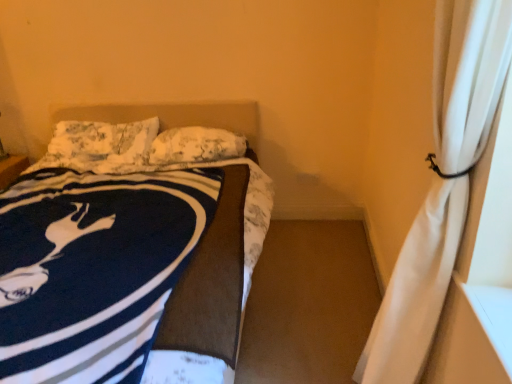
Measure the distance between point (111, 159) and camera.

Point (111, 159) is 8.45 feet from camera.

What do you see at coordinates (196, 145) in the screenshot?
I see `white textured pillow at center, which appears as the 2th pillow when viewed from the left` at bounding box center [196, 145].

This screenshot has height=384, width=512. I want to click on white textured pillow at center, which appears as the 2th pillow when viewed from the left, so click(x=196, y=145).

You are a GUI agent. You are given a task and a screenshot of the screen. Output one action in this format:
    pyautogui.click(x=<x>, y=<y>)
    Task: Click on the fluffy white pillow at upper left, which is the second pillow from right to left
    The image size is (512, 384).
    Given the screenshot: What is the action you would take?
    pyautogui.click(x=99, y=145)

Can you confirm if fluffy white pillow at upper left, which is the 1th pillow in left-to-right order, is shorter than white sheer curtain at right?

Yes.

Is point (95, 125) positioned behind point (465, 127)?

That is True.

From a real-world perspective, does fluffy white pillow at upper left, which is the 1th pillow in left-to-right order, stand above white sheer curtain at right?

No, from a real-world perspective, fluffy white pillow at upper left, which is the 1th pillow in left-to-right order, is not above white sheer curtain at right.

Looking at this image, how much distance is there between fluffy white pillow at upper left, which is the 1th pillow in left-to-right order, and white sheer curtain at right?

They are 6.43 feet apart.

Which is less distant, (x=120, y=130) or (x=59, y=316)?

Clearly, point (x=120, y=130) is more distant from the camera than point (x=59, y=316).

Is fluffy white pillow at upper left, which is the second pillow from right to left, further to the viewer compared to navy blue fleece blanket at left?

That is True.

Visually, is fluffy white pillow at upper left, which is the 1th pillow in left-to-right order, positioned to the left or to the right of navy blue fleece blanket at left?

In the image, fluffy white pillow at upper left, which is the 1th pillow in left-to-right order, appears on the left side of navy blue fleece blanket at left.

Considering the sizes of objects fluffy white pillow at upper left, which is the second pillow from right to left, and navy blue fleece blanket at left in the image provided, who is thinner, fluffy white pillow at upper left, which is the second pillow from right to left, or navy blue fleece blanket at left?

fluffy white pillow at upper left, which is the second pillow from right to left.

Does point (149, 141) come closer to viewer compared to point (215, 129)?

Yes.

Between fluffy white pillow at upper left, which is the second pillow from right to left, and white textured pillow at center, which appears as the 2th pillow when viewed from the left, which one has larger size?

With larger size is fluffy white pillow at upper left, which is the second pillow from right to left.

This screenshot has width=512, height=384. Identify the location of pillow that is above the white textured pillow at center, which appears as the 2th pillow when viewed from the left (from a real-world perspective). [99, 145].

Considering the sizes of fluffy white pillow at upper left, which is the 1th pillow in left-to-right order, and white textured pillow at center, which appears as the 2th pillow when viewed from the left, in the image, is fluffy white pillow at upper left, which is the 1th pillow in left-to-right order, wider or thinner than white textured pillow at center, which appears as the 2th pillow when viewed from the left,?

fluffy white pillow at upper left, which is the 1th pillow in left-to-right order, is wider than white textured pillow at center, which appears as the 2th pillow when viewed from the left.

Consider the image. From the image's perspective, between white sheer curtain at right and white textured pillow at center, placed as the 1th pillow when sorted from right to left, which one is located above?

white textured pillow at center, placed as the 1th pillow when sorted from right to left.

Is white sheer curtain at right wider or thinner than white textured pillow at center, which appears as the 2th pillow when viewed from the left?

white sheer curtain at right is thinner than white textured pillow at center, which appears as the 2th pillow when viewed from the left.

You are a GUI agent. You are given a task and a screenshot of the screen. Output one action in this format:
    pyautogui.click(x=<x>, y=<y>)
    Task: Click on the curtain above the white textured pillow at center, which appears as the 2th pillow when viewed from the left (from a real-world perspective)
    The image size is (512, 384).
    Given the screenshot: What is the action you would take?
    pyautogui.click(x=442, y=185)

Choose the correct answer: Is white sheer curtain at right inside white textured pillow at center, which appears as the 2th pillow when viewed from the left, or outside it?

white sheer curtain at right is spatially situated outside white textured pillow at center, which appears as the 2th pillow when viewed from the left.

Locate an element on the screen. The width and height of the screenshot is (512, 384). curtain that appears in front of the white textured pillow at center, placed as the 1th pillow when sorted from right to left is located at coordinates (442, 185).

Does white textured pillow at center, which appears as the 2th pillow when viewed from the left, appear on the right side of white sheer curtain at right?

No, white textured pillow at center, which appears as the 2th pillow when viewed from the left, is not to the right of white sheer curtain at right.

Are white textured pillow at center, placed as the 1th pillow when sorted from right to left, and white sheer curtain at right making contact?

white textured pillow at center, placed as the 1th pillow when sorted from right to left, and white sheer curtain at right are not in contact.

Does point (242, 154) lie in front of point (453, 157)?

No, it is not.

Relative to white sheer curtain at right, is navy blue fleece blanket at left in front or behind?

In the image, navy blue fleece blanket at left appears behind white sheer curtain at right.

Would you say navy blue fleece blanket at left is inside or outside white sheer curtain at right?

navy blue fleece blanket at left exists outside the volume of white sheer curtain at right.

Is navy blue fleece blanket at left bigger than white sheer curtain at right?

Correct, navy blue fleece blanket at left is larger in size than white sheer curtain at right.

Looking at this image, does white sheer curtain at right have a larger size compared to fluffy white pillow at upper left, which is the second pillow from right to left?

Yes.

From a real-world perspective, is white sheer curtain at right above or below fluffy white pillow at upper left, which is the second pillow from right to left?

white sheer curtain at right is situated higher than fluffy white pillow at upper left, which is the second pillow from right to left, in the real world.

At what (x,y) coordinates should I click in order to perform the action: click on pillow that is the 2nd object to the left of the white sheer curtain at right, starting at the anchor. Please return your answer as a coordinate pair (x, y). Looking at the image, I should click on (99, 145).

The width and height of the screenshot is (512, 384). Find the location of `bed that appears below the fluffy white pillow at upper left, which is the 1th pillow in left-to-right order (from a real-world perspective)`. bed that appears below the fluffy white pillow at upper left, which is the 1th pillow in left-to-right order (from a real-world perspective) is located at coordinates (106, 265).

Based on their spatial positions, is white textured pillow at center, placed as the 1th pillow when sorted from right to left, or navy blue fleece blanket at left further from white sheer curtain at right?

white textured pillow at center, placed as the 1th pillow when sorted from right to left, is further to white sheer curtain at right.

Looking at the image, which one is located closer to fluffy white pillow at upper left, which is the second pillow from right to left, navy blue fleece blanket at left or white textured pillow at center, which appears as the 2th pillow when viewed from the left?

The object closer to fluffy white pillow at upper left, which is the second pillow from right to left, is white textured pillow at center, which appears as the 2th pillow when viewed from the left.

Estimate the real-world distances between objects in this image. Which object is closer to white sheer curtain at right, navy blue fleece blanket at left or white textured pillow at center, which appears as the 2th pillow when viewed from the left?

navy blue fleece blanket at left lies closer to white sheer curtain at right than the other object.

Which object lies nearer to the anchor point white textured pillow at center, placed as the 1th pillow when sorted from right to left, navy blue fleece blanket at left or white sheer curtain at right?

Based on the image, navy blue fleece blanket at left appears to be nearer to white textured pillow at center, placed as the 1th pillow when sorted from right to left.

From the image, which object appears to be farther from fluffy white pillow at upper left, which is the second pillow from right to left, white sheer curtain at right or white textured pillow at center, which appears as the 2th pillow when viewed from the left?

white sheer curtain at right is further to fluffy white pillow at upper left, which is the second pillow from right to left.

When comparing their distances from white sheer curtain at right, does white textured pillow at center, placed as the 1th pillow when sorted from right to left, or fluffy white pillow at upper left, which is the 1th pillow in left-to-right order, seem closer?

Among the two, white textured pillow at center, placed as the 1th pillow when sorted from right to left, is located nearer to white sheer curtain at right.

In the scene shown: Considering their positions, is fluffy white pillow at upper left, which is the 1th pillow in left-to-right order, positioned closer to white sheer curtain at right than navy blue fleece blanket at left?

navy blue fleece blanket at left is closer to white sheer curtain at right.

From the image, which object appears to be nearer to navy blue fleece blanket at left, fluffy white pillow at upper left, which is the second pillow from right to left, or white sheer curtain at right?

fluffy white pillow at upper left, which is the second pillow from right to left.

At what (x,y) coordinates should I click in order to perform the action: click on pillow between white sheer curtain at right and fluffy white pillow at upper left, which is the 1th pillow in left-to-right order, in the front-back direction. Please return your answer as a coordinate pair (x, y). Image resolution: width=512 pixels, height=384 pixels. Looking at the image, I should click on (196, 145).

I want to click on pillow positioned between navy blue fleece blanket at left and fluffy white pillow at upper left, which is the 1th pillow in left-to-right order, from near to far, so click(x=196, y=145).

In order to click on bed positioned between white sheer curtain at right and fluffy white pillow at upper left, which is the 1th pillow in left-to-right order, from near to far in this screenshot , I will do `click(106, 265)`.

At what (x,y) coordinates should I click in order to perform the action: click on bed between white sheer curtain at right and white textured pillow at center, placed as the 1th pillow when sorted from right to left, in the front-back direction. Please return your answer as a coordinate pair (x, y). Looking at the image, I should click on (106, 265).